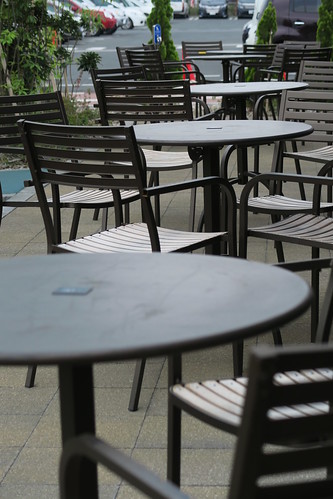
You are a GUI agent. You are given a task and a screenshot of the screen. Output one action in this format:
    pyautogui.click(x=<x>, y=<y>)
    Task: Click on the tables
    Image resolution: width=333 pixels, height=499 pixels.
    Given the screenshot: What is the action you would take?
    pyautogui.click(x=112, y=299), pyautogui.click(x=205, y=136), pyautogui.click(x=238, y=86), pyautogui.click(x=234, y=57)